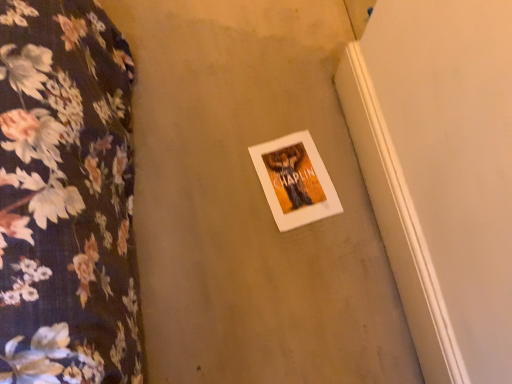
Find the location of a particular element. free point below white paper at center (from a real-world perspective) is located at coordinates (286, 177).